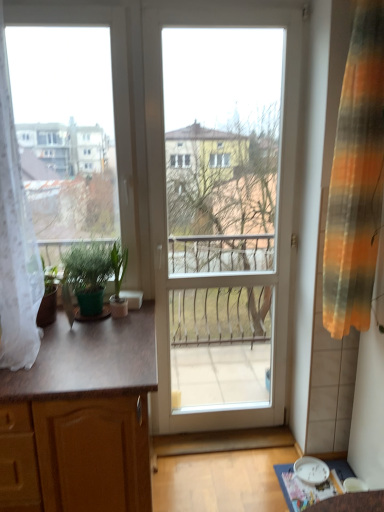
The image size is (384, 512). I want to click on free space above white glossy door at center (from a real-world perspective), so click(x=220, y=4).